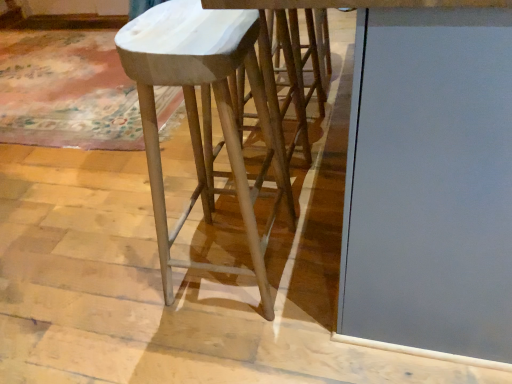
Image resolution: width=512 pixels, height=384 pixels. In order to click on vacant space that is to the left of white marble stool at center in this screenshot , I will do `click(118, 283)`.